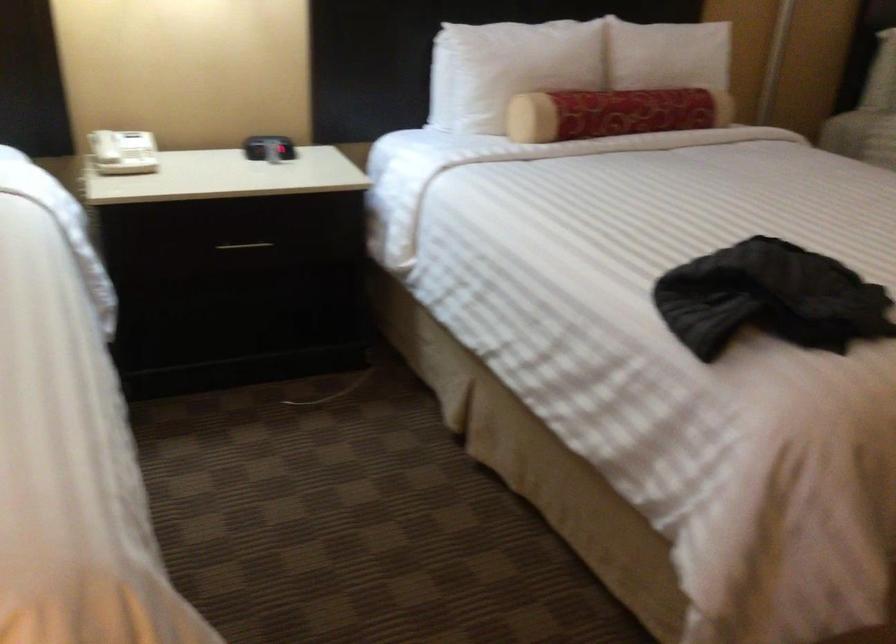
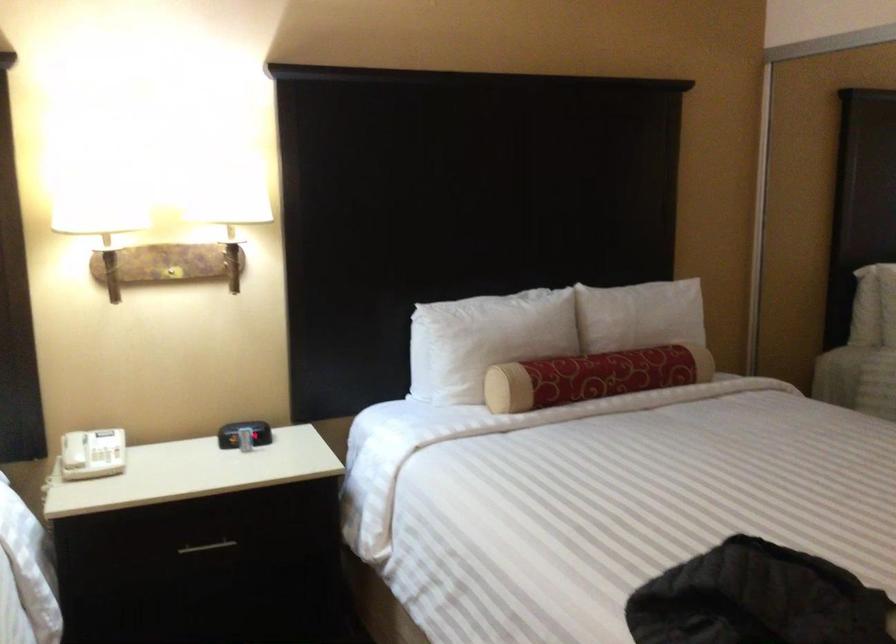
Where in the second image is the point corresponding to pixel 112 147 from the first image?

(73, 450)